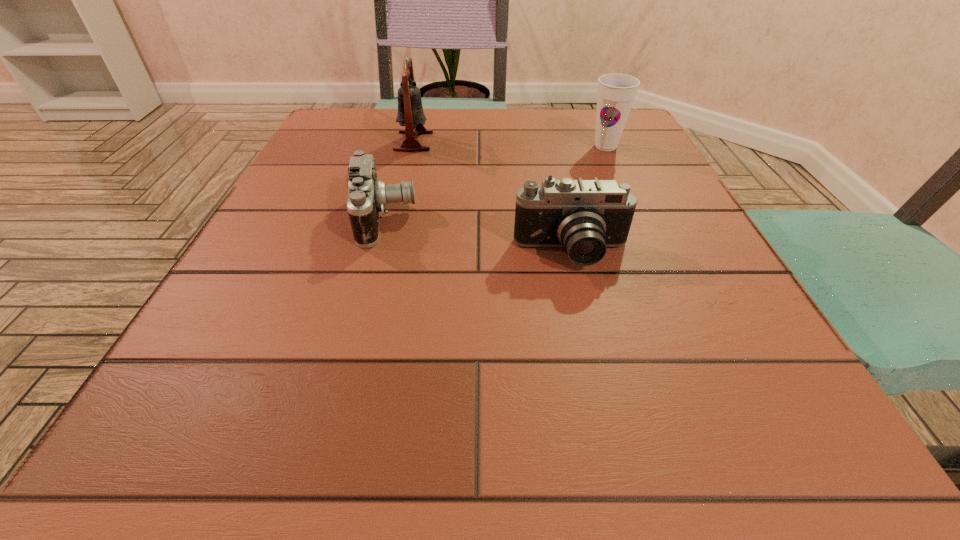
This screenshot has width=960, height=540. Find the location of `free space at the near left corner`. free space at the near left corner is located at coordinates (181, 444).

The image size is (960, 540). I want to click on free space at the far right corner, so click(x=651, y=145).

Identify the location of free space between the taller camera and the tallest object. (493, 198).

Find the location of a particular element. This screenshot has height=540, width=960. vacant area that lies between the shorter camera and the right camera is located at coordinates (478, 236).

The width and height of the screenshot is (960, 540). Identify the location of free point between the third shortest object and the bell. (510, 144).

You are a GUI agent. You are given a task and a screenshot of the screen. Output one action in this format:
    pyautogui.click(x=<x>, y=<y>)
    Task: Click on the vacant space that is in between the second tallest object and the tallest object
    The image size is (960, 540).
    Given the screenshot: What is the action you would take?
    pyautogui.click(x=510, y=144)

The image size is (960, 540). Identify the location of free space that is in between the tallest object and the left camera. (399, 180).

Identify the location of empty space that is in between the tallest object and the shortest object. Image resolution: width=960 pixels, height=540 pixels. (399, 180).

Locate an element on the screen. free space between the tallest object and the taller camera is located at coordinates (493, 198).

This screenshot has width=960, height=540. I want to click on free space between the second tallest object and the shorter camera, so click(495, 183).